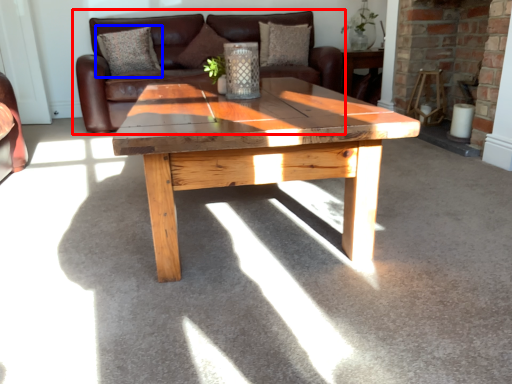
Question: Which of the following is the farthest to the observer, studio couch (highlighted by a red box) or pillow (highlighted by a blue box)?

Choices:
 (A) studio couch
 (B) pillow

Answer: (B)